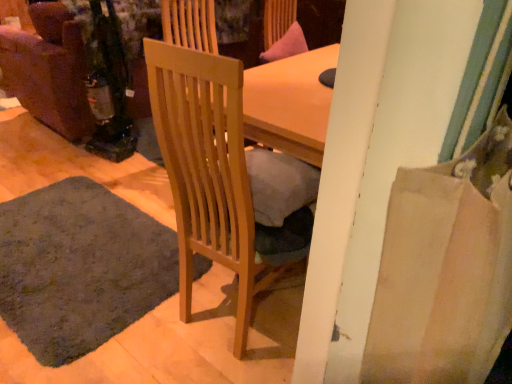
At what (x,y) coordinates should I click in order to perform the action: click on vacant space behind dark gray carpet at lower left. Please return your answer as a coordinate pair (x, y). Looking at the image, I should click on 89,170.